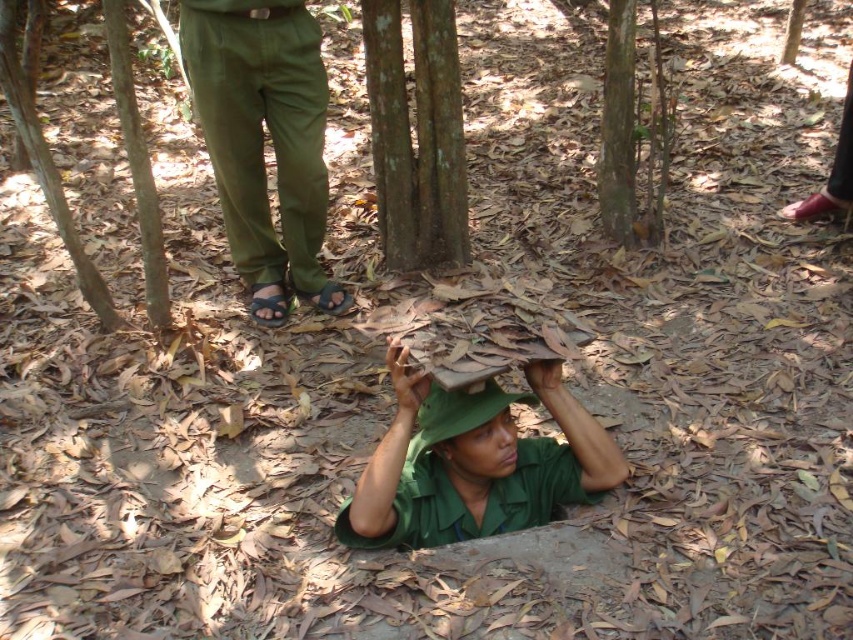
You are a hiker who wants to place a 6.5 feet long tent between the smooth brown bark at center and the brown rough tree at center. Can you fit the tent between them?

The smooth brown bark at center and the brown rough tree at center are 6.61 feet apart, so the tent can be placed between them since it is slightly shorter than the distance between the two objects.

You are a hiker who has spotted the olive green pants at center in the forest. You want to take a photo of them but need to stay at least 2 meters away to avoid disturbing the area. Given their exact coordinates, can you position yourself far enough away?

The olive green pants at center are located at point (260, 129). To stay at least 2 meters away, you must position yourself outside this coordinate range, ensuring sufficient distance to avoid disturbance.